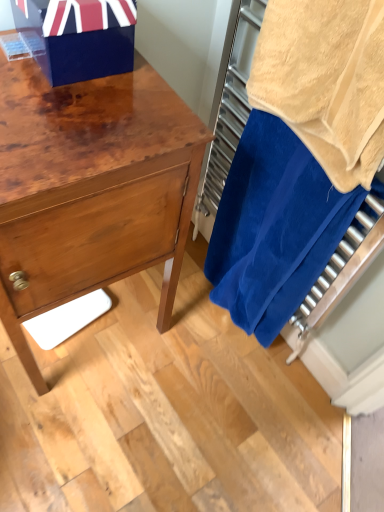
Where is `vacant location below shiny wood chest of drawers at left (from a real-world perspective)`? This screenshot has width=384, height=512. vacant location below shiny wood chest of drawers at left (from a real-world perspective) is located at coordinates (105, 328).